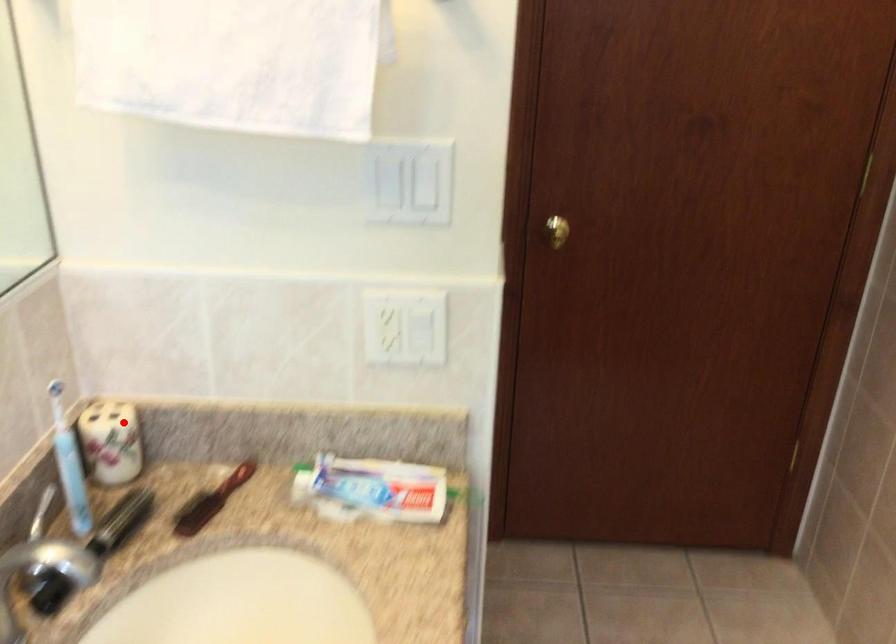
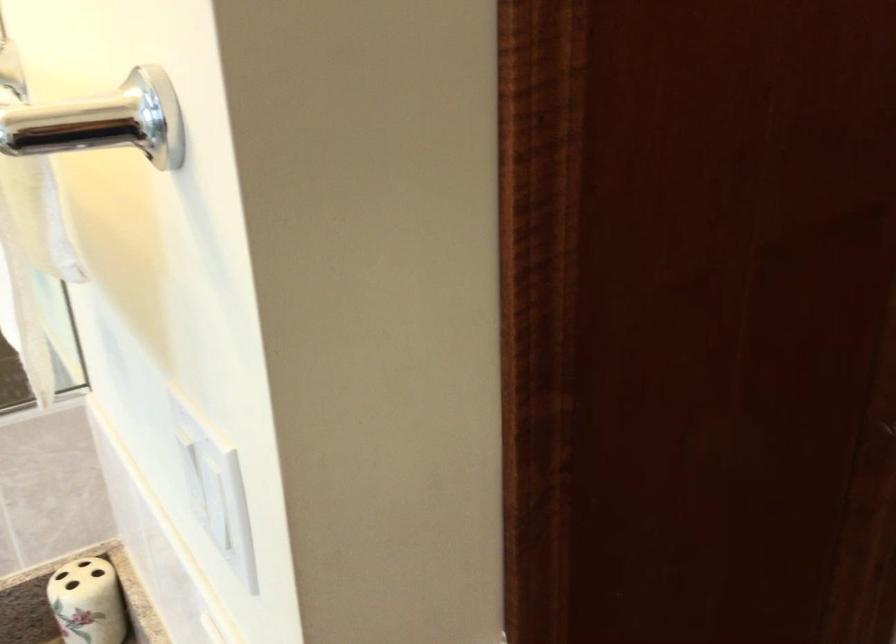
Question: A red point is marked in image1. In image2, is the corresponding 3D point closer to the camera or farther? Reply with the corresponding letter.

Choices:
 (A) The corresponding 3D point is closer.
 (B) The corresponding 3D point is farther.

Answer: (A)